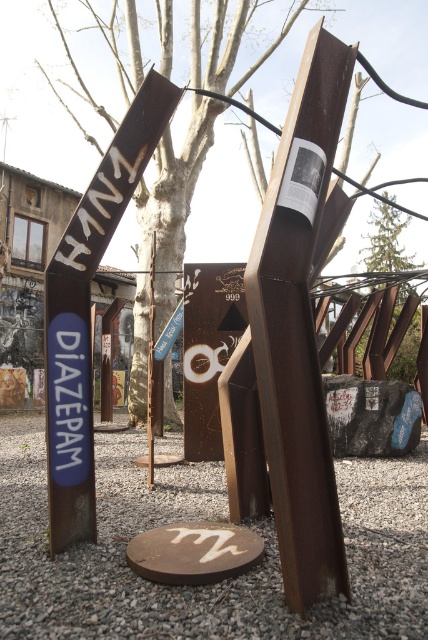
Does rustic wood tree at center have a greater width compared to green leafy tree at upper center?

No, rustic wood tree at center is not wider than green leafy tree at upper center.

Does rustic wood tree at center have a lesser height compared to green leafy tree at upper center?

In fact, rustic wood tree at center may be taller than green leafy tree at upper center.

You are a GUI agent. You are given a task and a screenshot of the screen. Output one action in this format:
    pyautogui.click(x=<x>, y=<y>)
    Task: Click on the rustic wood tree at center
    Image resolution: width=428 pixels, height=640 pixels.
    Given the screenshot: What is the action you would take?
    pyautogui.click(x=175, y=186)

The image size is (428, 640). In order to click on rustic wood tree at center in this screenshot , I will do `click(175, 186)`.

Is rusty metal sign at left positioned before green leafy tree at upper center?

That is True.

Between point (59, 272) and point (380, 204), which one is positioned in front?

Point (59, 272) is in front.

Describe the element at coordinates (89, 310) in the screenshot. I see `rusty metal sign at left` at that location.

This screenshot has width=428, height=640. I want to click on rusty metal sign at left, so 89,310.

Which is above, rusty gravel at center or green leafy tree at upper center?

Positioned higher is green leafy tree at upper center.

Does rusty gravel at center appear on the right side of green leafy tree at upper center?

No, rusty gravel at center is not to the right of green leafy tree at upper center.

This screenshot has width=428, height=640. Describe the element at coordinates (198, 520) in the screenshot. I see `rusty gravel at center` at that location.

Find the location of a particular element. The height and width of the screenshot is (640, 428). rusty gravel at center is located at coordinates (198, 520).